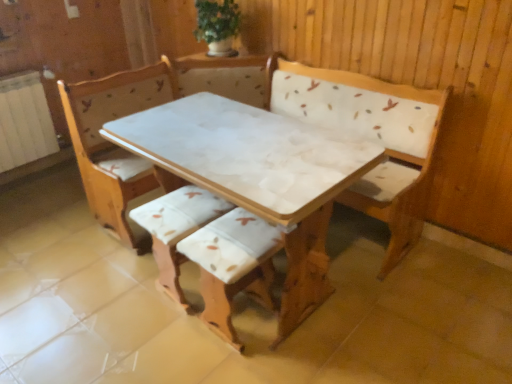
Question: Is white marble table at center not close to white fabric cushion at center, which is the first armchair in left-to-right order?

Choices:
 (A) yes
 (B) no

Answer: (B)

Question: Is white marble table at center closer to the viewer compared to white fabric cushion at center, which is the 2th armchair from right to left?

Choices:
 (A) yes
 (B) no

Answer: (A)

Question: Does white marble table at center have a greater height compared to white fabric cushion at center, which is the 2th armchair from right to left?

Choices:
 (A) no
 (B) yes

Answer: (B)

Question: Is white marble table at center directly adjacent to white fabric cushion at center, which is the first armchair in left-to-right order?

Choices:
 (A) no
 (B) yes

Answer: (A)

Question: Is white marble table at center shorter than white fabric cushion at center, which is the 2th armchair from right to left?

Choices:
 (A) no
 (B) yes

Answer: (A)

Question: Considering their positions, is white fabric cushion at center, which is the 2th armchair from right to left, located in front of or behind green leafy plant at upper center?

Choices:
 (A) behind
 (B) front

Answer: (B)

Question: Is white fabric cushion at center, which is the 2th armchair from right to left, taller or shorter than green leafy plant at upper center?

Choices:
 (A) tall
 (B) short

Answer: (A)

Question: Would you say white fabric cushion at center, which is the first armchair in left-to-right order, is to the left or to the right of green leafy plant at upper center in the picture?

Choices:
 (A) left
 (B) right

Answer: (A)

Question: Considering the positions of white fabric cushion at center, which is the first armchair in left-to-right order, and green leafy plant at upper center in the image, is white fabric cushion at center, which is the first armchair in left-to-right order, bigger or smaller than green leafy plant at upper center?

Choices:
 (A) big
 (B) small

Answer: (A)

Question: In terms of height, does wooden armchair at center, which is the first armchair in right-to-left order, look taller or shorter compared to white marble table at center?

Choices:
 (A) tall
 (B) short

Answer: (B)

Question: In terms of width, does wooden armchair at center, which is the first armchair in right-to-left order, look wider or thinner when compared to white marble table at center?

Choices:
 (A) wide
 (B) thin

Answer: (B)

Question: Based on their positions, is wooden armchair at center, marked as the second armchair in a left-to-right arrangement, located to the left or right of white marble table at center?

Choices:
 (A) left
 (B) right

Answer: (A)

Question: Is wooden armchair at center, which is the first armchair in right-to-left order, spatially inside white marble table at center, or outside of it?

Choices:
 (A) outside
 (B) inside

Answer: (B)

Question: Visually, is white marble table at center positioned to the left or to the right of white fabric cushion at center, which is the first armchair in left-to-right order?

Choices:
 (A) right
 (B) left

Answer: (A)

Question: Is point (108, 139) positioned closer to the camera than point (151, 208)?

Choices:
 (A) closer
 (B) farther

Answer: (A)